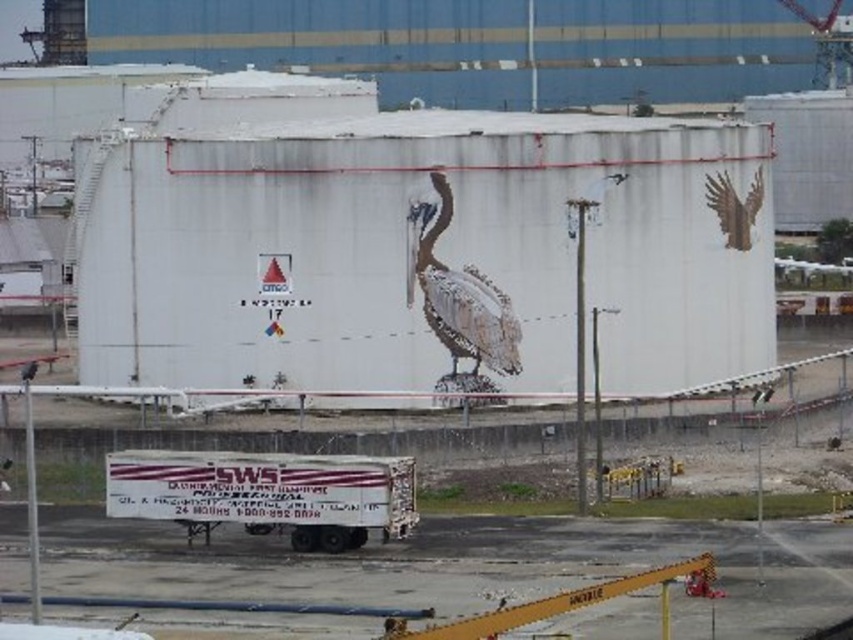
You are a crane operator trying to lift the brown matte wings at upper right and place them onto the white matte trailer truck at center. Based on the scene, will the wings fit vertically on the trailer without exceeding its height?

The white matte trailer truck at center has a greater height compared to brown matte wings at upper right. Therefore, the wings will fit vertically on the trailer without exceeding its height.

You are a delivery driver who needs to park your truck next to the brown textured pelican at center and the brown matte wings at upper right. Based on their positions, which object should you park closer to if you want to be near both without being too far from either?

The brown textured pelican at center is below brown matte wings at upper right, so parking closer to the pelican would place you nearer to both since they are vertically aligned.